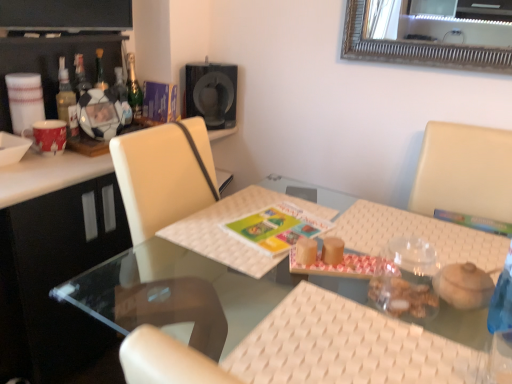
Question: In terms of width, does matte plastic soccer ball at left look wider or thinner when compared to translucent glass bottle at upper left, which ranks as the second bottle in back-to-front order?

Choices:
 (A) thin
 (B) wide

Answer: (B)

Question: From the image's perspective, is matte plastic soccer ball at left above or below translucent glass bottle at upper left, positioned as the second bottle in front-to-back order?

Choices:
 (A) above
 (B) below

Answer: (B)

Question: Which object is positioned closest to the white woven mat at left?

Choices:
 (A) white woven placemat at right, arranged as the first place mat when viewed from the right
 (B) translucent glass bottle at upper left, which ranks as the second bottle in back-to-front order
 (C) white woven placemat at center, which is the first place mat in left-to-right order
 (D) white woven mat at center
 (E) red glossy mug at left

Answer: (E)

Question: Estimate the real-world distances between objects in this image. Which object is closer to the white woven mat at center?

Choices:
 (A) white woven mat at left
 (B) translucent glass bottle at left, the third bottle positioned from the back
 (C) translucent glass bottle at upper left, positioned as the second bottle in front-to-back order
 (D) translucent plastic container at table center
 (E) clear glass table at center

Answer: (D)